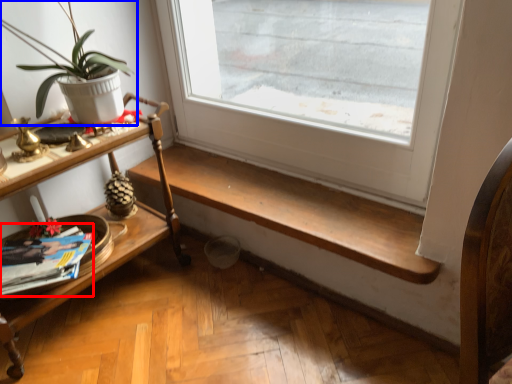
Question: Which object is closer to the camera taking this photo, magazine (highlighted by a red box) or houseplant (highlighted by a blue box)?

Choices:
 (A) magazine
 (B) houseplant

Answer: (B)